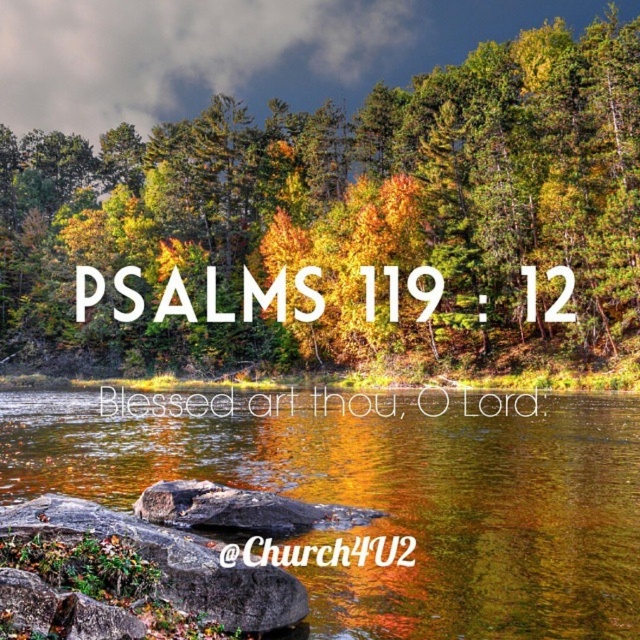
You are standing at the shore of the lake and want to place a small decorative statue on the closest object to you. Which object should you choose between the shiny reflective water at center and the gray rough rock at center?

The shiny reflective water at center is closer to the viewer than the gray rough rock at center, so you should place the statue on the shiny reflective water at center.

You are a photographer trying to capture the reflection of the autumn trees in the shiny reflective water at center. However, the gray rough rock at center is blocking part of the reflection. Can you estimate whether the water surface is large enough to frame the trees without the rock obstructing the view?

The shiny reflective water at center is bigger than gray rough rock at center, so the water surface is large enough to frame the trees without the gray rough rock at center obstructing the view.